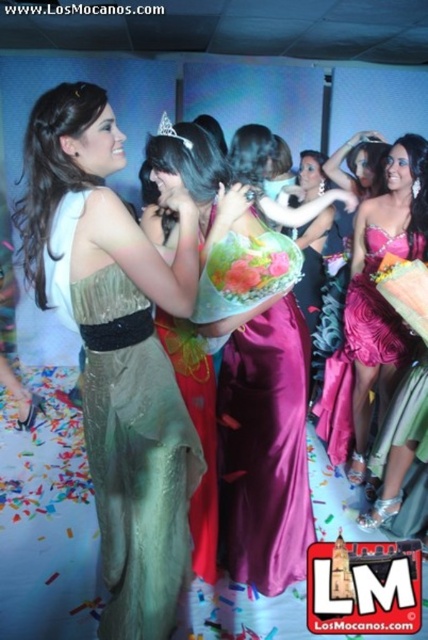
Does point (241, 236) lie behind point (285, 310)?

No, it is in front of (285, 310).

Looking at this image, can you confirm if shiny satin dress at center is positioned to the right of silky purple dress at center?

Yes, shiny satin dress at center is to the right of silky purple dress at center.

Locate an element on the screen. shiny satin dress at center is located at coordinates (250, 358).

This screenshot has height=640, width=428. In order to click on shiny satin dress at center in this screenshot , I will do `click(250, 358)`.

Does green satin dress at center have a greater height compared to satin gold dress at center?

Yes, green satin dress at center is taller than satin gold dress at center.

Is green satin dress at center positioned in front of satin gold dress at center?

That is True.

Identify the location of green satin dress at center. The image size is (428, 640). (116, 349).

Is point (187, 278) positioned after point (166, 118)?

No, it is in front of (166, 118).

Is green satin dress at center thinner than clear crystal tiara at upper center?

Incorrect, green satin dress at center's width is not less than clear crystal tiara at upper center's.

Measure the distance between point [65,252] and camera.

Point [65,252] is 4.39 feet from camera.

The width and height of the screenshot is (428, 640). I want to click on green satin dress at center, so click(116, 349).